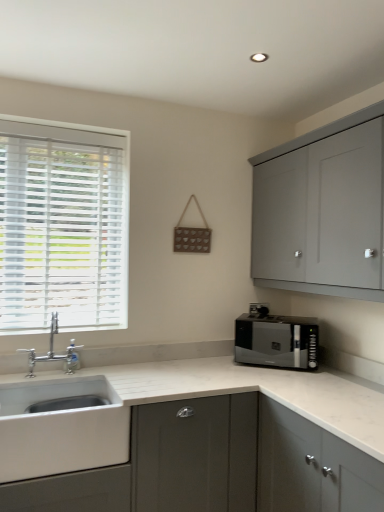
Question: Can you confirm if white wood blinds at left is positioned to the right of matte gray cabinet at lower left, which appears as the first cabinetry when ordered from the bottom?

Choices:
 (A) yes
 (B) no

Answer: (B)

Question: From the image's perspective, does white wood blinds at left appear higher than matte gray cabinet at lower left, which appears as the first cabinetry when ordered from the bottom?

Choices:
 (A) yes
 (B) no

Answer: (A)

Question: Is white wood blinds at left taller than matte gray cabinet at lower left, acting as the 2th cabinetry starting from the right?

Choices:
 (A) yes
 (B) no

Answer: (A)

Question: From a real-world perspective, does white wood blinds at left stand above matte gray cabinet at lower left, which appears as the first cabinetry when ordered from the bottom?

Choices:
 (A) no
 (B) yes

Answer: (B)

Question: Is white wood blinds at left positioned in front of matte gray cabinet at lower left, which appears as the 1th cabinetry when viewed from the left?

Choices:
 (A) no
 (B) yes

Answer: (A)

Question: From their relative heights in the image, would you say matte gray cabinet at lower left, acting as the 2th cabinetry starting from the right, is taller or shorter than silver metallic faucet at left?

Choices:
 (A) short
 (B) tall

Answer: (B)

Question: Considering the positions of matte gray cabinet at lower left, acting as the 2th cabinetry starting from the right, and silver metallic faucet at left in the image, is matte gray cabinet at lower left, acting as the 2th cabinetry starting from the right, wider or thinner than silver metallic faucet at left?

Choices:
 (A) wide
 (B) thin

Answer: (A)

Question: In the image, is matte gray cabinet at lower left, acting as the 2th cabinetry starting from the right, positioned in front of or behind silver metallic faucet at left?

Choices:
 (A) front
 (B) behind

Answer: (A)

Question: Is matte gray cabinet at lower left, which appears as the first cabinetry when ordered from the bottom, bigger or smaller than silver metallic faucet at left?

Choices:
 (A) big
 (B) small

Answer: (A)

Question: From a real-world perspective, is matte gray cabinet at upper right, which ranks as the 2th cabinetry in bottom-to-top order, physically located above or below white wood blinds at left?

Choices:
 (A) above
 (B) below

Answer: (A)

Question: Considering the positions of matte gray cabinet at upper right, which ranks as the 2th cabinetry in bottom-to-top order, and white wood blinds at left in the image, is matte gray cabinet at upper right, which ranks as the 2th cabinetry in bottom-to-top order, bigger or smaller than white wood blinds at left?

Choices:
 (A) big
 (B) small

Answer: (A)

Question: Considering the relative positions of matte gray cabinet at upper right, which is the 1th cabinetry in top-to-bottom order, and white wood blinds at left in the image provided, is matte gray cabinet at upper right, which is the 1th cabinetry in top-to-bottom order, to the left or to the right of white wood blinds at left?

Choices:
 (A) right
 (B) left

Answer: (A)

Question: Is point (258, 172) positioned closer to the camera than point (59, 280)?

Choices:
 (A) farther
 (B) closer

Answer: (A)

Question: Looking at their shapes, would you say shiny black microwave at right is wider or thinner than matte gray cabinet at upper right, the second cabinetry positioned from the left?

Choices:
 (A) thin
 (B) wide

Answer: (A)

Question: From the image's perspective, is shiny black microwave at right located above or below matte gray cabinet at upper right, positioned as the first cabinetry in right-to-left order?

Choices:
 (A) below
 (B) above

Answer: (A)